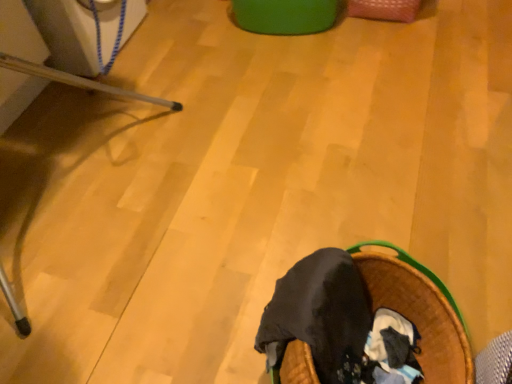
Identify the location of blank area to the left of dark fabric laundry basket at lower center. The image size is (512, 384). (195, 318).